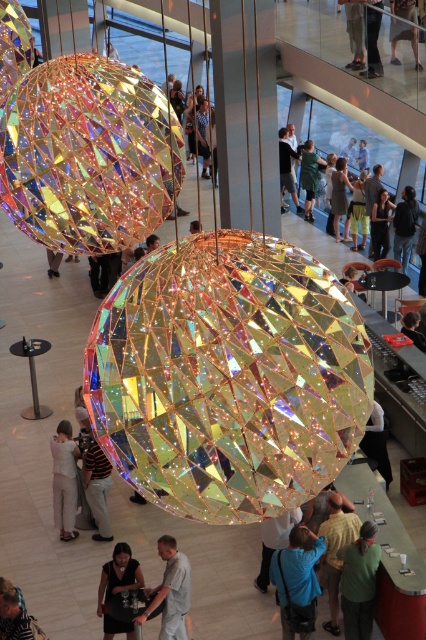
You are standing in the gallery and want to find the blue fabric jacket at lower center. According to the coordinates provided, where should you look relative to the center of the image?

The blue fabric jacket at lower center is located at point coordinates approximately 0.909 on the x axis and 0.697 on the y axis, which means it is positioned to the right and slightly above the center of the image.